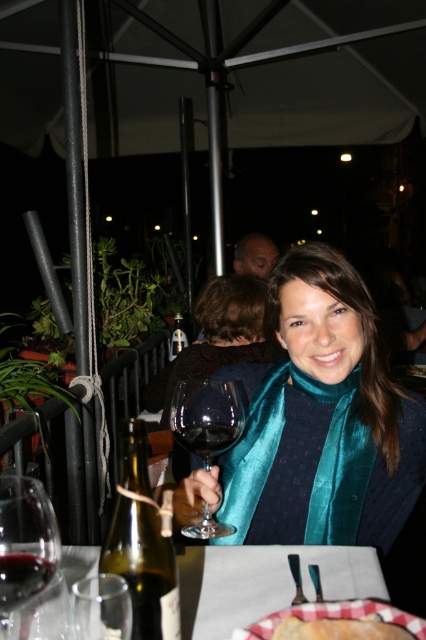
You are a waiter at the outdoor dining area and need to place a new wine glass on the table. The table has a transparent glass at center and a translucent glass bottle at center. Where should you place the new glass so it doesn not interfere with the existing items?

The transparent glass at center is below the translucent glass bottle at center, so placing the new glass next to the translucent glass bottle at center would avoid interference with the existing items.

You are a server at the restaurant and need to choose a wine glass for a customer who prefers a wider rim for their Cabernet Sauvignon. Which glass should you select between the transparent glass wine glass at center and the clear glass wine glass at lower left?

The transparent glass wine glass at center has a greater width than the clear glass wine glass at lower left, so it is the better choice for a wider rim.